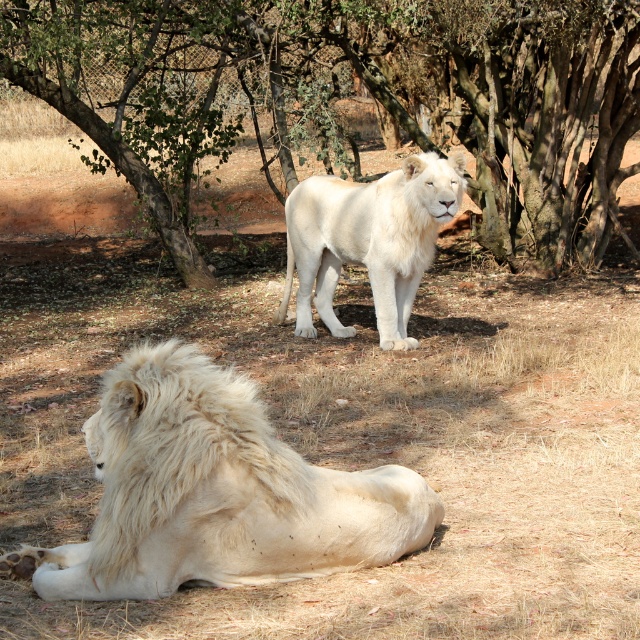
Question: Which object appears closest to the camera in this image?

Choices:
 (A) fuzzy white lion at lower left
 (B) white fluffy lion at center

Answer: (A)

Question: Which point appears farthest from the camera in this image?

Choices:
 (A) (381, 275)
 (B) (205, 566)
 (C) (442, 128)

Answer: (C)

Question: Observing the image, what is the correct spatial positioning of green leafy tree at upper center in reference to fuzzy white lion at lower left?

Choices:
 (A) below
 (B) above

Answer: (B)

Question: Can you confirm if fuzzy white lion at lower left is positioned above white fluffy lion at center?

Choices:
 (A) no
 (B) yes

Answer: (A)

Question: Which object is positioned closest to the green leafy tree at upper center?

Choices:
 (A) white fluffy lion at center
 (B) fuzzy white lion at lower left

Answer: (A)

Question: Observing the image, what is the correct spatial positioning of fuzzy white lion at lower left in reference to white fluffy lion at center?

Choices:
 (A) left
 (B) right

Answer: (A)